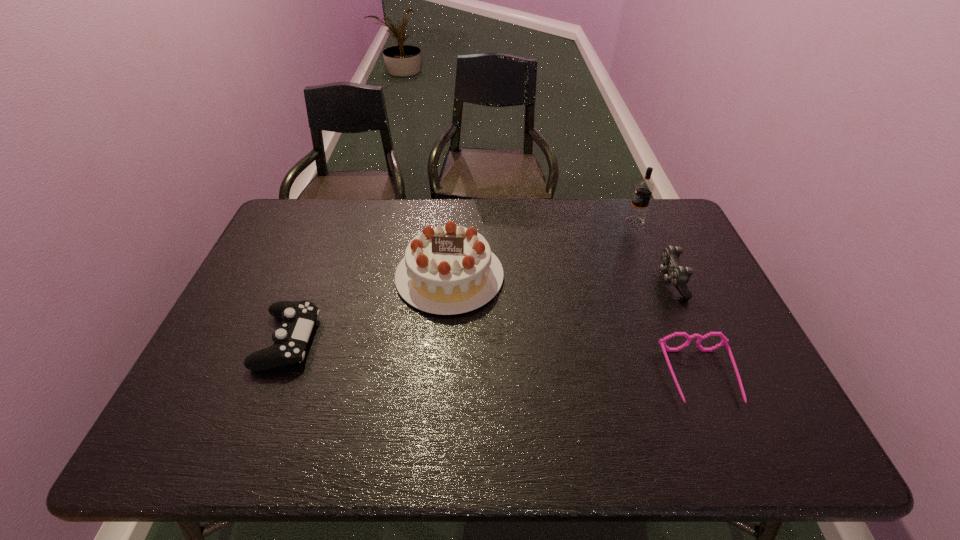
Where is `blank region between the second object from left to right and the spectacles`? The width and height of the screenshot is (960, 540). blank region between the second object from left to right and the spectacles is located at coordinates (575, 327).

Where is `free spot between the third shortest object and the spectacles`? This screenshot has height=540, width=960. free spot between the third shortest object and the spectacles is located at coordinates tap(685, 329).

I want to click on empty location between the leftmost object and the fourth object from right to left, so click(x=369, y=308).

I want to click on blank region between the tallest object and the birthday cake, so click(x=542, y=249).

You are a GUI agent. You are given a task and a screenshot of the screen. Output one action in this format:
    pyautogui.click(x=<x>, y=<y>)
    Task: Click on the free space between the spectacles and the left control
    This screenshot has height=540, width=960.
    Given the screenshot: What is the action you would take?
    pyautogui.click(x=494, y=359)

Where is `vacant space in between the spectacles and the farthest object`? The height and width of the screenshot is (540, 960). vacant space in between the spectacles and the farthest object is located at coordinates (667, 299).

I want to click on vacant space that is in between the third shortest object and the vodka, so click(x=653, y=252).

The width and height of the screenshot is (960, 540). I want to click on unoccupied area between the spectacles and the taller control, so click(685, 329).

Find the location of a particular element. This screenshot has width=960, height=540. object that stands as the fourth closest to the right control is located at coordinates (298, 317).

Find the location of a particular element. The width and height of the screenshot is (960, 540). object that ranks as the closest to the spectacles is located at coordinates (675, 273).